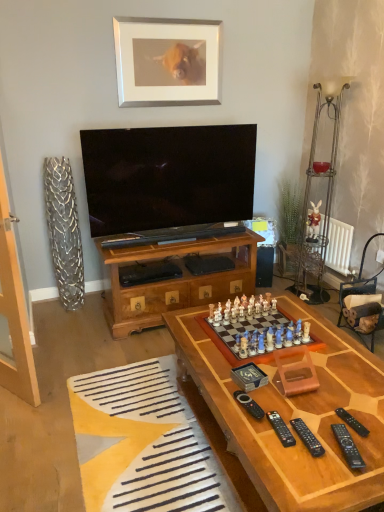
Identify the location of free space above wooden chessboard at center (from a real-world perspective). (301, 377).